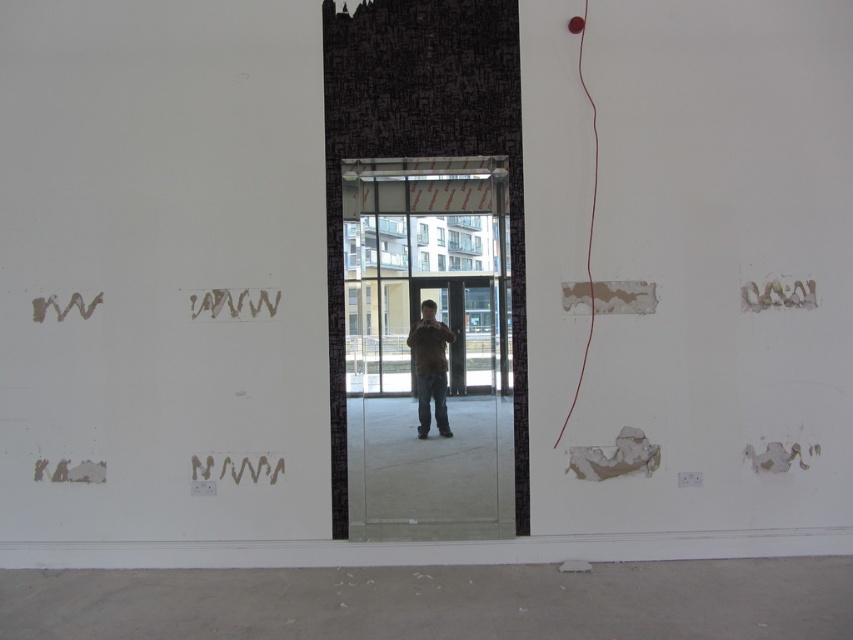
Is transparent glass door at center further to the viewer compared to wavy paper at lower center?

Yes, it is.

Is transparent glass door at center wider than wavy paper at lower center?

Yes, transparent glass door at center is wider than wavy paper at lower center.

Who is more distant from viewer, (479, 212) or (239, 465)?

Positioned behind is point (479, 212).

The height and width of the screenshot is (640, 853). I want to click on transparent glass door at center, so click(428, 346).

Which is behind, point (448, 180) or point (422, 396)?

Positioned behind is point (448, 180).

The height and width of the screenshot is (640, 853). In order to click on transparent glass door at center in this screenshot , I will do `click(428, 346)`.

Between red matte string at right and black matte text at center, which one has less height?

black matte text at center

How much distance is there between red matte string at right and black matte text at center?

red matte string at right is 7.27 feet away from black matte text at center.

Is point (595, 129) closer to camera compared to point (198, 300)?

No.

The image size is (853, 640). In order to click on red matte string at right in this screenshot , I will do `click(589, 211)`.